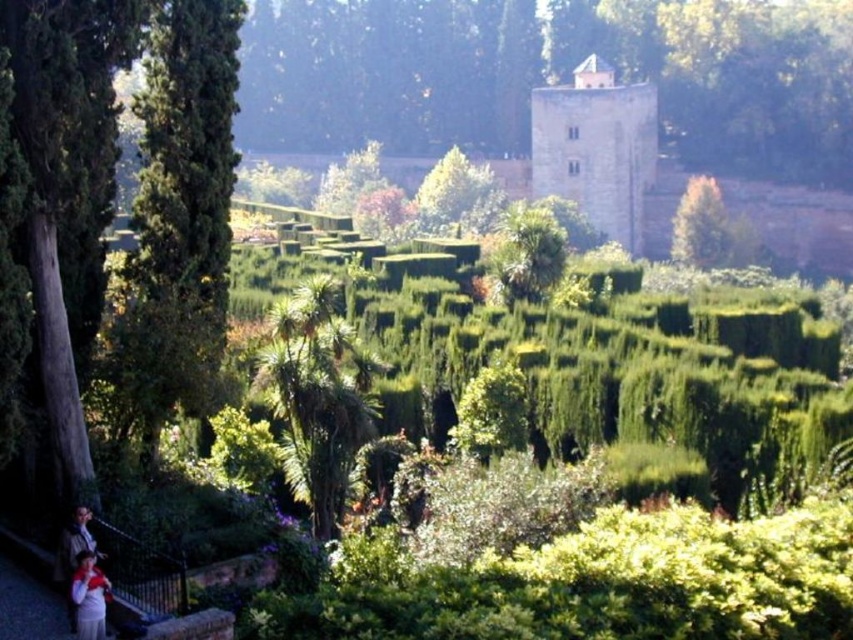
Question: Which of these objects is positioned farthest from the green leafy tree at upper center?

Choices:
 (A) green textured tree at left
 (B) stone tower at upper center
 (C) green leafy tree at center

Answer: (A)

Question: Does green leafy tree at upper center have a lesser width compared to green leafy tree at upper right?

Choices:
 (A) no
 (B) yes

Answer: (A)

Question: Estimate the real-world distances between objects in this image. Which object is farther from the green textured tree at left?

Choices:
 (A) light brown fabric at lower left
 (B) matte white shirt at lower left
 (C) green leafy tree at center

Answer: (C)

Question: Observing the image, what is the correct spatial positioning of green leafy palm at center in reference to green leafy tree at center?

Choices:
 (A) right
 (B) left

Answer: (B)

Question: Estimate the real-world distances between objects in this image. Which object is closer to the green leafy tree at center?

Choices:
 (A) green leafy tree at upper right
 (B) stone tower at upper center
 (C) green textured tree at left
 (D) light brown fabric at lower left

Answer: (B)

Question: Observing the image, what is the correct spatial positioning of green leafy palm at center in reference to matte white shirt at lower left?

Choices:
 (A) left
 (B) right

Answer: (B)